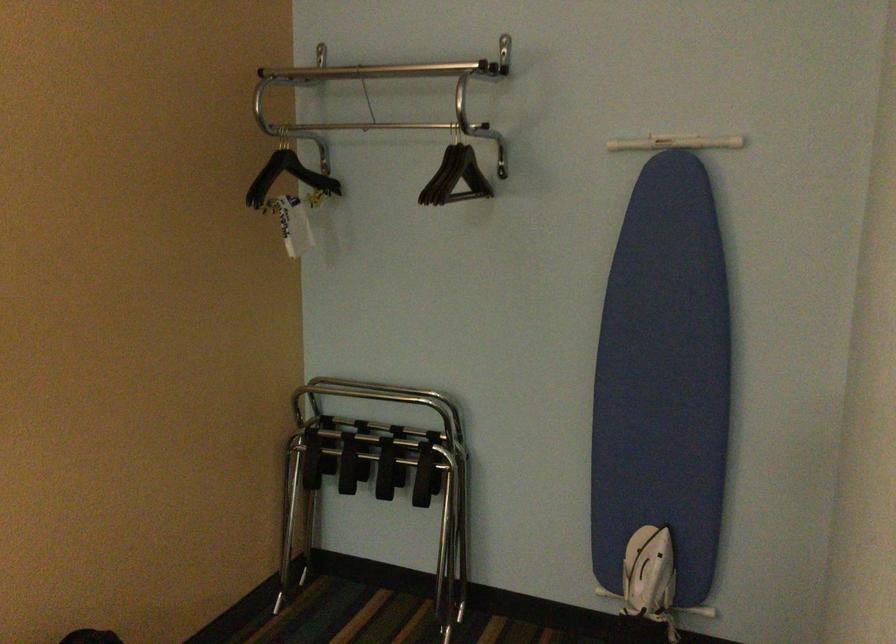
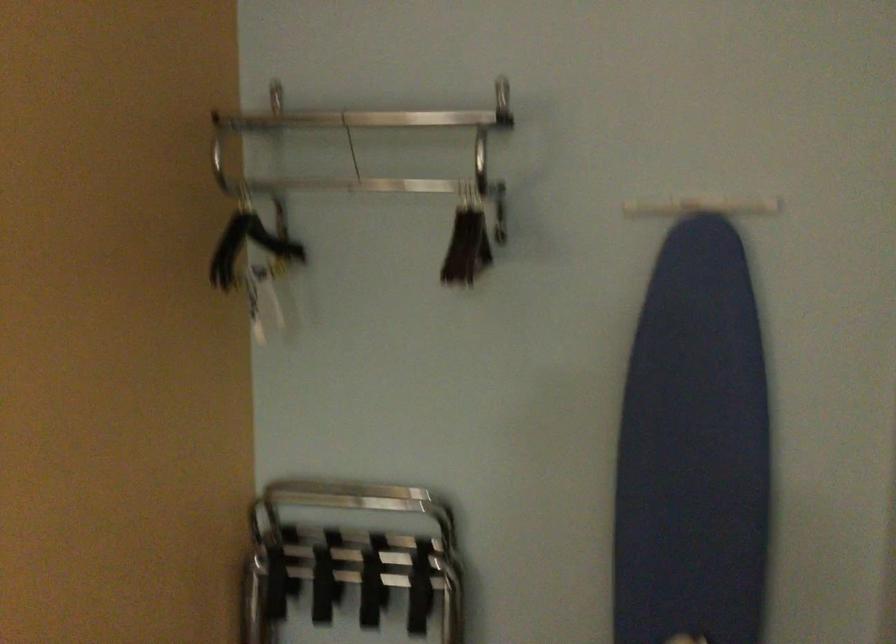
Question: The images are taken continuously from a first-person perspective. In which direction is your viewpoint rotating?

Choices:
 (A) Left
 (B) Right
 (C) Up
 (D) Down

Answer: (B)